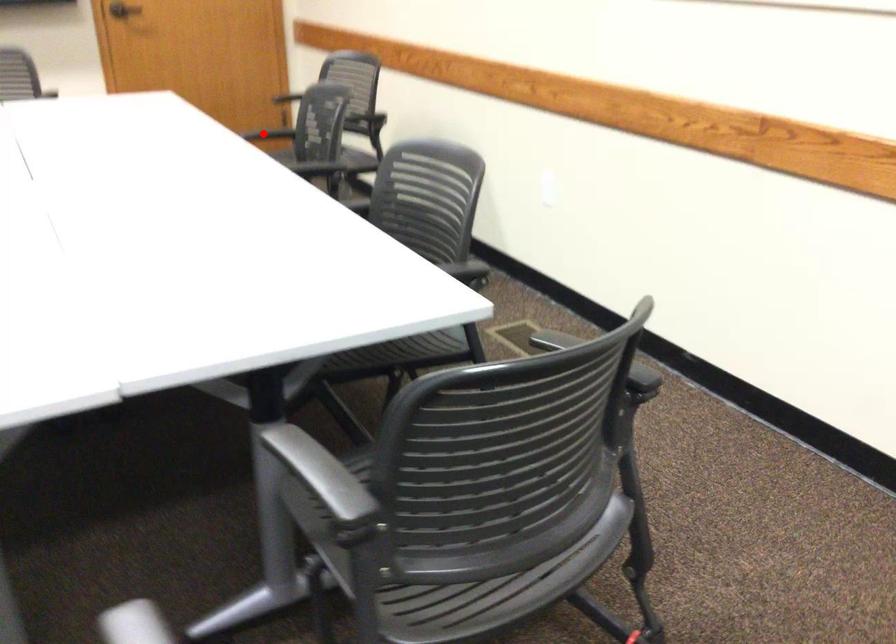
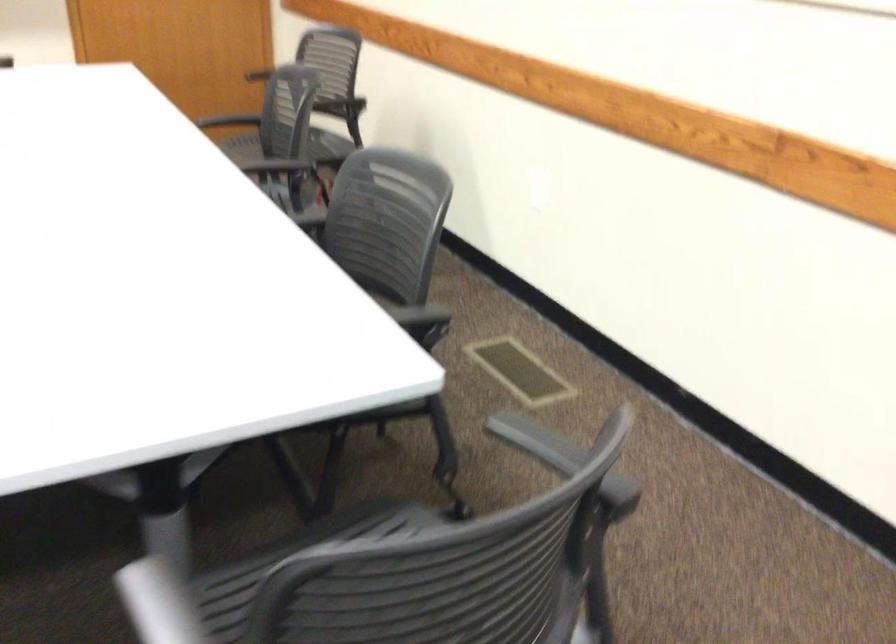
In the second image, find the point that corresponds to the highlighted location in the first image.

(228, 120)